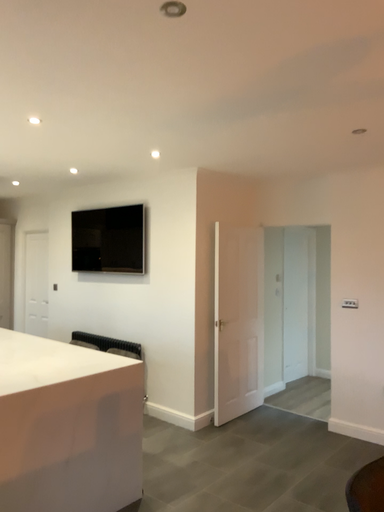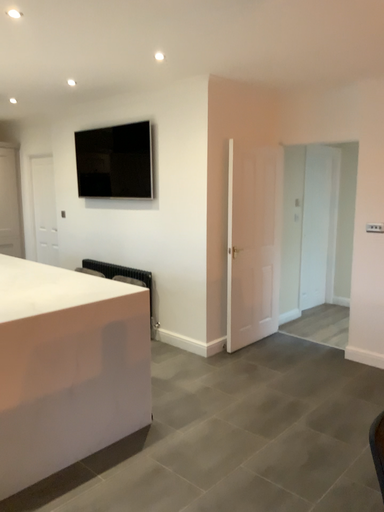
Question: How did the camera likely rotate when shooting the video?

Choices:
 (A) rotated upward
 (B) rotated downward

Answer: (B)